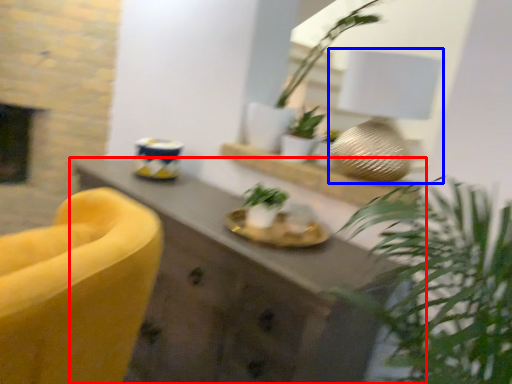
Question: Which of the following is the farthest to the observer, desk (highlighted by a red box) or table lamp (highlighted by a blue box)?

Choices:
 (A) desk
 (B) table lamp

Answer: (B)